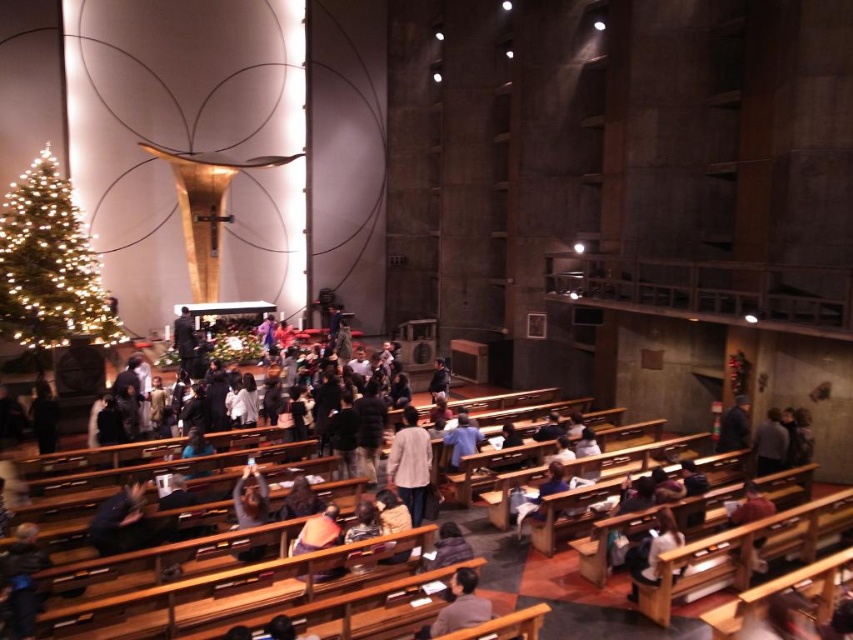
Does dark gray sweater at lower right lie in front of dark blue shirt at center?

No, it is behind dark blue shirt at center.

Does dark gray sweater at lower right appear on the right side of dark blue shirt at center?

Yes, dark gray sweater at lower right is to the right of dark blue shirt at center.

In order to click on dark gray sweater at lower right in this screenshot , I will do `click(770, 444)`.

The image size is (853, 640). Find the location of `dark gray sweater at lower right`. dark gray sweater at lower right is located at coordinates (770, 444).

Which of these two, light gray sweater at center or light brown wooden bench at lower center, stands shorter?

light brown wooden bench at lower center

Locate an element on the screen. light gray sweater at center is located at coordinates (410, 465).

Locate an element on the screen. light gray sweater at center is located at coordinates (410, 465).

How far apart are dark blue jacket at center and dark blue jacket at lower right?

13.59 meters

Does dark blue jacket at center have a smaller size compared to dark blue jacket at lower right?

Correct, dark blue jacket at center occupies less space than dark blue jacket at lower right.

What do you see at coordinates (120, 520) in the screenshot? The width and height of the screenshot is (853, 640). I see `dark blue jacket at center` at bounding box center [120, 520].

Find the location of a particular element. The height and width of the screenshot is (640, 853). dark blue jacket at center is located at coordinates (120, 520).